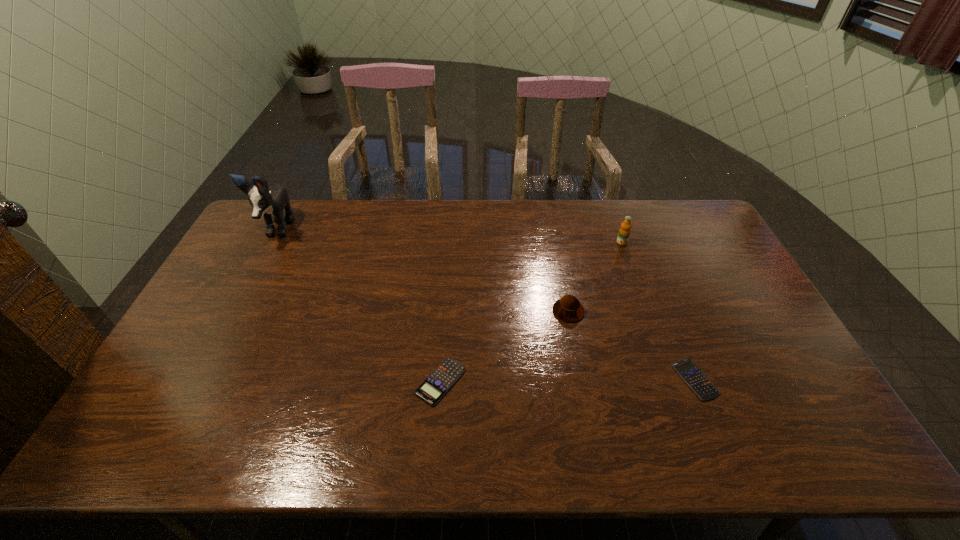
This screenshot has height=540, width=960. What are the coordinates of `the tallest object` in the screenshot? It's located at (264, 200).

Find the location of a particular element. The image size is (960, 540). the leftmost object is located at coordinates (264, 200).

Find the location of `the fourth shortest object`. the fourth shortest object is located at coordinates (624, 232).

What are the coordinates of `muffin` in the screenshot? It's located at (568, 308).

Where is `the third object from right to left`? The image size is (960, 540). the third object from right to left is located at coordinates (568, 308).

The width and height of the screenshot is (960, 540). What are the coordinates of `the taller calculator` in the screenshot? It's located at (439, 382).

Find the location of a particular element. Image resolution: width=960 pixels, height=540 pixels. the left calculator is located at coordinates (439, 382).

Identify the location of the right calculator. The image size is (960, 540). (692, 375).

Image resolution: width=960 pixels, height=540 pixels. I want to click on the shortest object, so click(x=692, y=375).

Locate an element on the screen. This screenshot has width=960, height=540. blank space located 0.380m on the front-facing side of the tallest object is located at coordinates (218, 340).